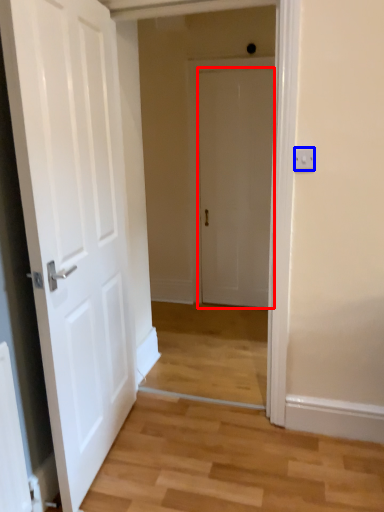
Question: Which point is closer to the camera, door (highlighted by a red box) or electric outlet (highlighted by a blue box)?

Choices:
 (A) door
 (B) electric outlet

Answer: (B)